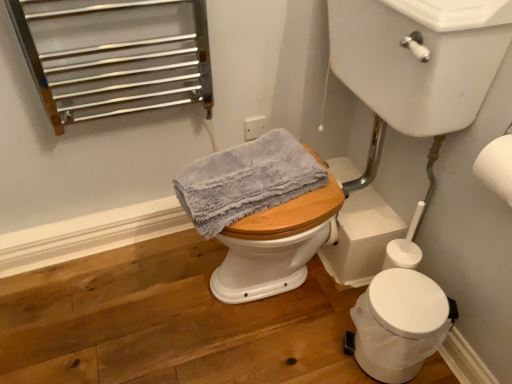
Identify the location of free location above white plastic trash can at lower right (from a real-world perspective). This screenshot has height=384, width=512. (407, 302).